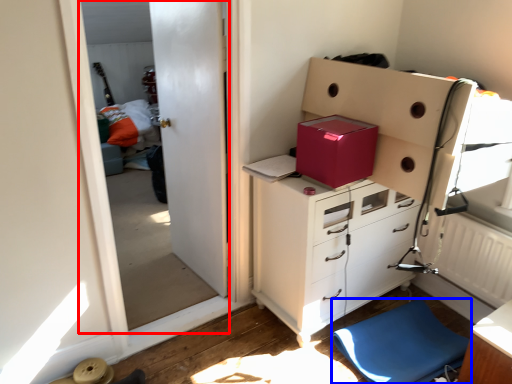
Question: Among these objects, which one is farthest to the camera, screen door (highlighted by a red box) or furniture (highlighted by a blue box)?

Choices:
 (A) screen door
 (B) furniture

Answer: (B)